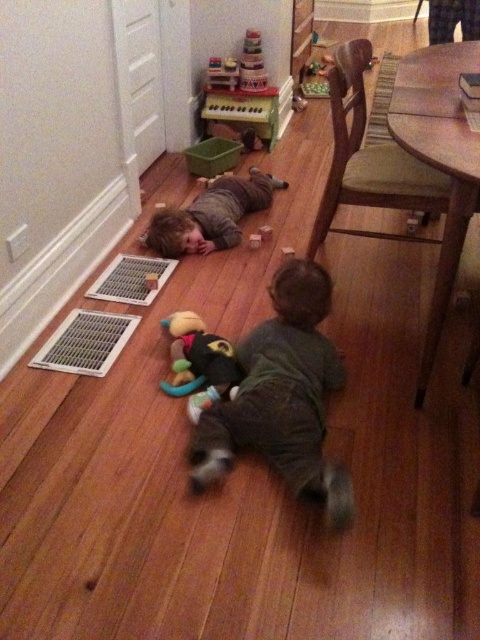
Question: Considering the real-world distances, which object is closest to the dark gray soft toddler at center?

Choices:
 (A) soft plush toy at center
 (B) matte gray shirt at center

Answer: (A)

Question: Where is dark gray soft toddler at center located in relation to soft plush toy at center in the image?

Choices:
 (A) left
 (B) right

Answer: (B)

Question: Which of the following is the closest to the observer?

Choices:
 (A) (220, 202)
 (B) (287, 406)

Answer: (B)

Question: Which point is closer to the camera?

Choices:
 (A) (176, 244)
 (B) (191, 467)
 (C) (233, 355)

Answer: (B)

Question: Can you confirm if dark gray soft toddler at center is positioned above soft plush toy at center?

Choices:
 (A) no
 (B) yes

Answer: (A)

Question: Observing the image, what is the correct spatial positioning of dark gray soft toddler at center in reference to matte gray shirt at center?

Choices:
 (A) above
 (B) below

Answer: (B)